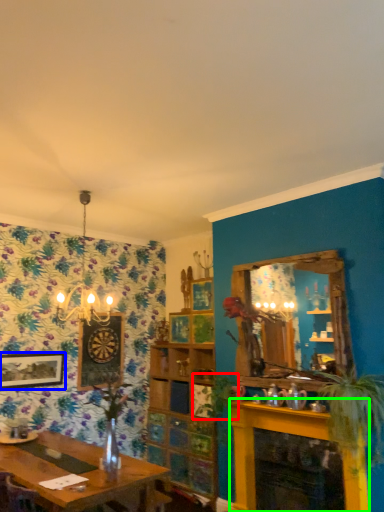
Question: Estimate the real-world distances between objects in this image. Which object is farther from plant (highlighted by a red box), picture frame (highlighted by a blue box) or fireplace (highlighted by a green box)?

Choices:
 (A) picture frame
 (B) fireplace

Answer: (A)